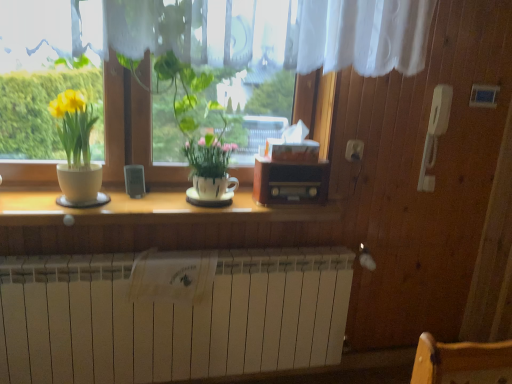
At what (x,y) coordinates should I click in order to perform the action: click on free space above wooden counter top at center (from a real-world perspective). Please return your answer as a coordinate pair (x, y). The width and height of the screenshot is (512, 384). Looking at the image, I should click on (156, 199).